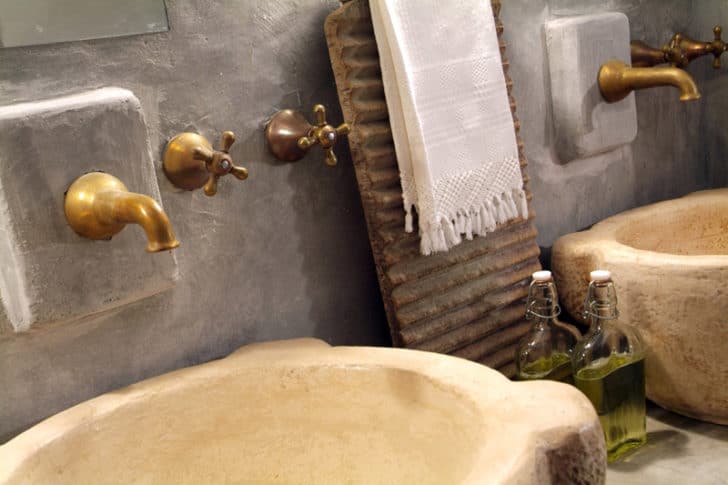
At what (x,y) coordinates should I click in order to perform the action: click on glass bottles. Please return your answer as a coordinate pair (x, y). This screenshot has height=485, width=728. Looking at the image, I should click on (546, 343), (620, 357).